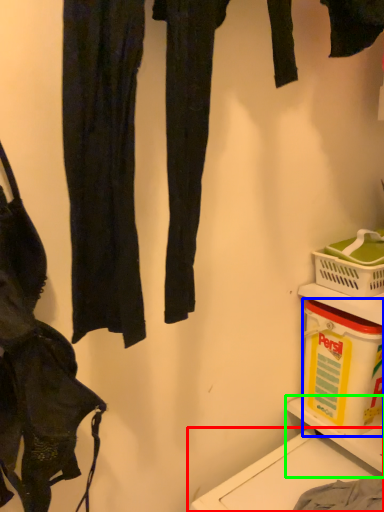
Question: Which is farther away from washing (highlighted by a red box)? box (highlighted by a blue box) or shelf (highlighted by a green box)?

Choices:
 (A) box
 (B) shelf

Answer: (A)